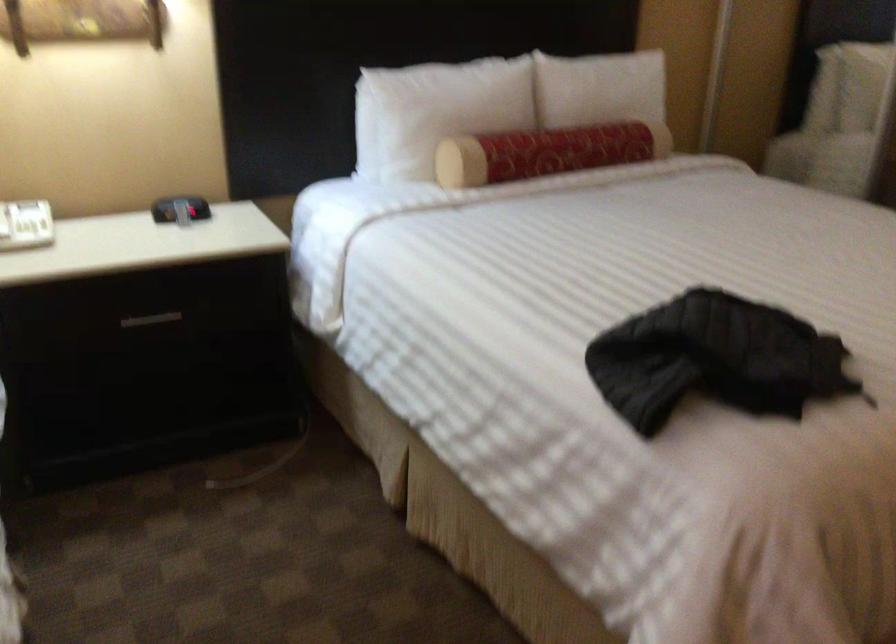
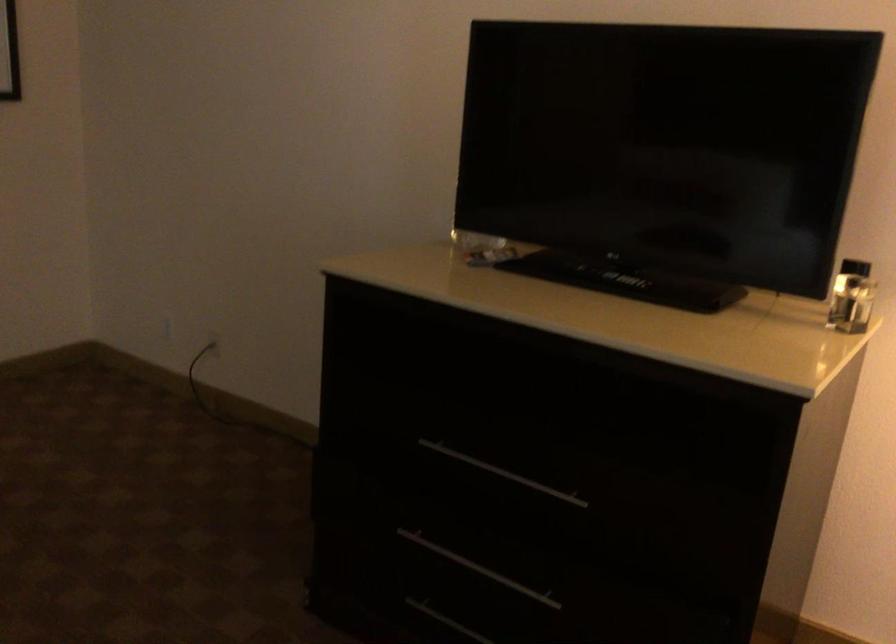
The first image is from the beginning of the video and the second image is from the end. How did the camera likely rotate when shooting the video?

The rotation direction of the camera is right-down.